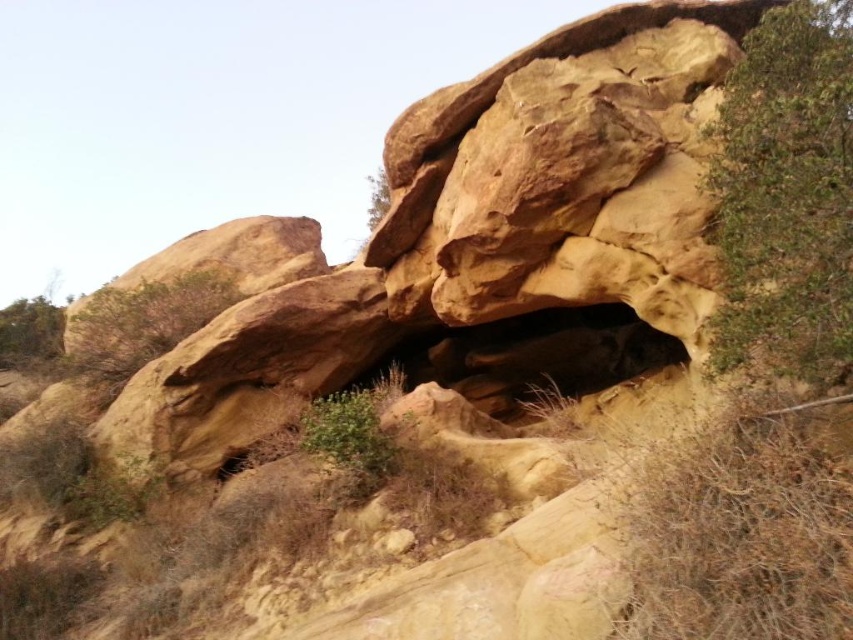
Looking at this image, which of these two, green leafy tree at left or green leafy tree at upper center, stands shorter?

With less height is green leafy tree at left.

Can you confirm if green leafy tree at left is smaller than green leafy tree at upper center?

No, green leafy tree at left is not smaller than green leafy tree at upper center.

Does point (6, 340) lie in front of point (368, 179)?

Yes, it is.

The height and width of the screenshot is (640, 853). What are the coordinates of `green leafy tree at left` in the screenshot? It's located at (28, 332).

Who is more distant from viewer, (781, 173) or (370, 209)?

Positioned behind is point (370, 209).

Describe the element at coordinates (787, 196) in the screenshot. Image resolution: width=853 pixels, height=640 pixels. I see `green leafy shrub at upper right` at that location.

You are a GUI agent. You are given a task and a screenshot of the screen. Output one action in this format:
    pyautogui.click(x=<x>, y=<y>)
    Task: Click on the green leafy shrub at upper right
    The height and width of the screenshot is (640, 853).
    Given the screenshot: What is the action you would take?
    pyautogui.click(x=787, y=196)

Image resolution: width=853 pixels, height=640 pixels. I want to click on green leafy shrub at upper right, so click(x=787, y=196).

Does green leafy shrub at upper right come behind green leafy tree at left?

No, green leafy shrub at upper right is in front of green leafy tree at left.

Describe the element at coordinates (787, 196) in the screenshot. I see `green leafy shrub at upper right` at that location.

Identify the location of green leafy shrub at upper right. This screenshot has height=640, width=853. (787, 196).